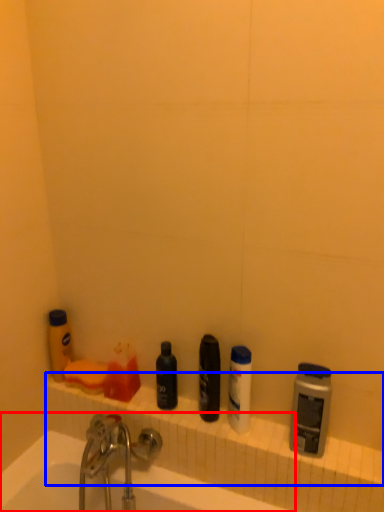
Question: Which object appears farthest to the camera in this image, bathtub (highlighted by a red box) or ledge (highlighted by a blue box)?

Choices:
 (A) bathtub
 (B) ledge

Answer: (B)